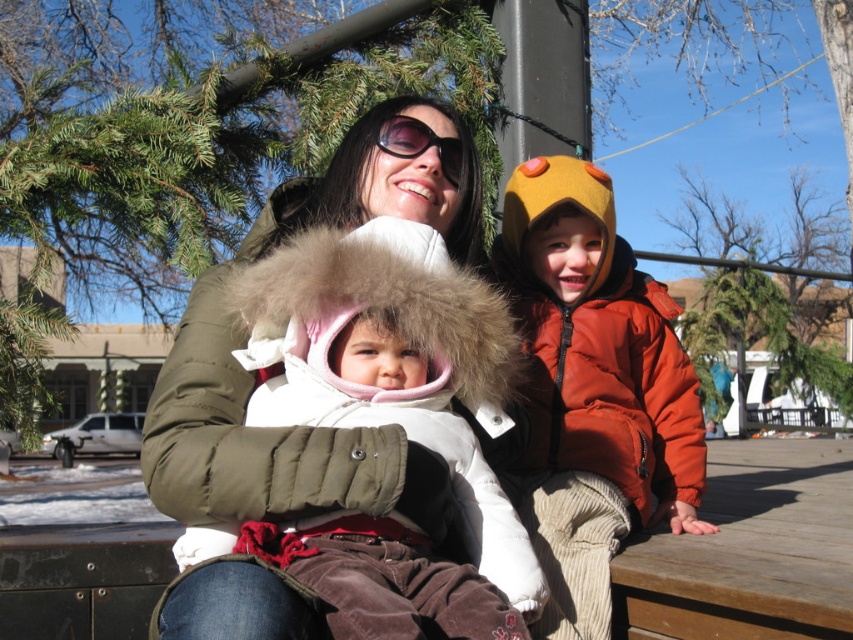
Question: Which object is the closest to the orange puffy jacket at right?

Choices:
 (A) sunglasses at center
 (B) white fur coat at center

Answer: (B)

Question: Is the position of white fur coat at center less distant than that of sunglasses at center?

Choices:
 (A) no
 (B) yes

Answer: (B)

Question: Which point is farther to the camera?

Choices:
 (A) orange puffy jacket at right
 (B) sunglasses at center

Answer: (B)

Question: Which object is closer to the camera taking this photo?

Choices:
 (A) white fur coat at center
 (B) sunglasses at center
 (C) orange puffy jacket at right

Answer: (A)

Question: Does white fur coat at center appear under orange puffy jacket at right?

Choices:
 (A) no
 (B) yes

Answer: (B)

Question: Does white fur coat at center have a lesser width compared to sunglasses at center?

Choices:
 (A) no
 (B) yes

Answer: (A)